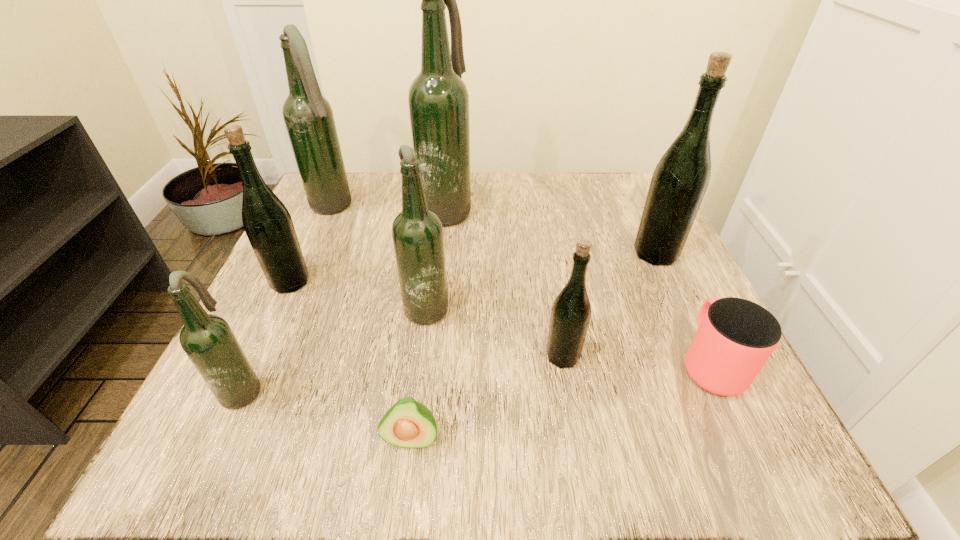
The image size is (960, 540). I want to click on free spot located on the right of the nearest dark beer bottle, so click(x=304, y=387).

Where is `vacant area situated on the handle side of the cup`? Image resolution: width=960 pixels, height=540 pixels. vacant area situated on the handle side of the cup is located at coordinates (655, 248).

This screenshot has width=960, height=540. I want to click on free space located on the handle side of the cup, so click(x=671, y=281).

The width and height of the screenshot is (960, 540). Find the location of `free space located on the handle side of the cup`. free space located on the handle side of the cup is located at coordinates (640, 218).

This screenshot has height=540, width=960. In order to click on beer bottle that is at the near edge in this screenshot , I will do `click(208, 341)`.

Find the location of a particular element. The image size is (960, 540). avocado that is at the near edge is located at coordinates click(407, 424).

At what (x,y) coordinates should I click in order to perform the action: click on beer bottle that is at the right edge. Please return your answer as a coordinate pair (x, y). This screenshot has width=960, height=540. Looking at the image, I should click on (680, 180).

Identify the location of cup located in the right edge section of the desktop. (735, 337).

I want to click on object that is at the far left corner, so click(308, 116).

At what (x,y) coordinates should I click in order to perform the action: click on object that is at the near left corner. Please return your answer as a coordinate pair (x, y). The image size is (960, 540). Looking at the image, I should click on (208, 341).